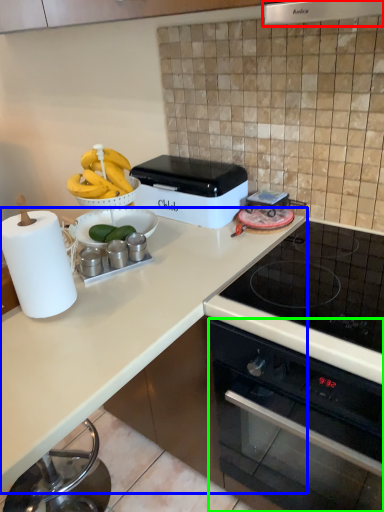
Question: Which is farther away from exhaust hood (highlighted by a red box)? countertop (highlighted by a blue box) or oven (highlighted by a green box)?

Choices:
 (A) countertop
 (B) oven

Answer: (B)